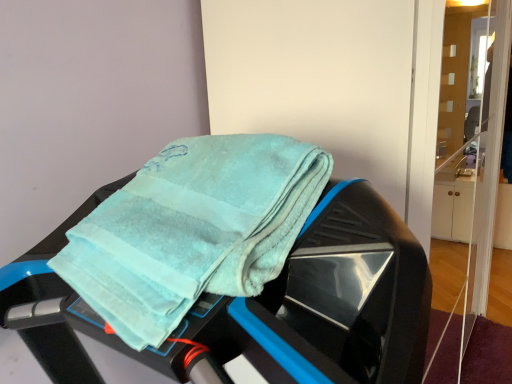
Image resolution: width=512 pixels, height=384 pixels. Describe the element at coordinates (193, 230) in the screenshot. I see `teal terry cloth towel at center` at that location.

Locate an element on the screen. Image resolution: width=512 pixels, height=384 pixels. teal terry cloth towel at center is located at coordinates (193, 230).

Where is `teal terry cloth towel at center`? The width and height of the screenshot is (512, 384). teal terry cloth towel at center is located at coordinates (193, 230).